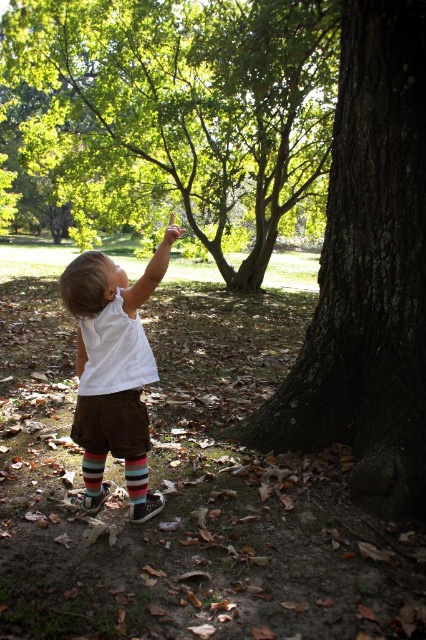
Question: Is the position of green leafy tree at center more distant than that of striped cotton sock at lower center?

Choices:
 (A) yes
 (B) no

Answer: (A)

Question: Does striped cotton sock at lower left have a smaller size compared to smooth brown hand at upper center?

Choices:
 (A) yes
 (B) no

Answer: (A)

Question: Among these objects, which one is farthest from the camera?

Choices:
 (A) smooth brown bark at center
 (B) green leafy tree at center

Answer: (B)

Question: Does white cotton toddler at center appear on the right side of striped cotton sock at lower center?

Choices:
 (A) yes
 (B) no

Answer: (B)

Question: Which object is closer to the camera taking this photo?

Choices:
 (A) striped cotton sock at lower center
 (B) green leafy tree at center
 (C) white cotton toddler at center

Answer: (C)

Question: Which of the following is the farthest from the observer?

Choices:
 (A) green leafy tree at center
 (B) white cotton toddler at center
 (C) striped cotton sock at lower left
 (D) striped cotton sock at lower center

Answer: (A)